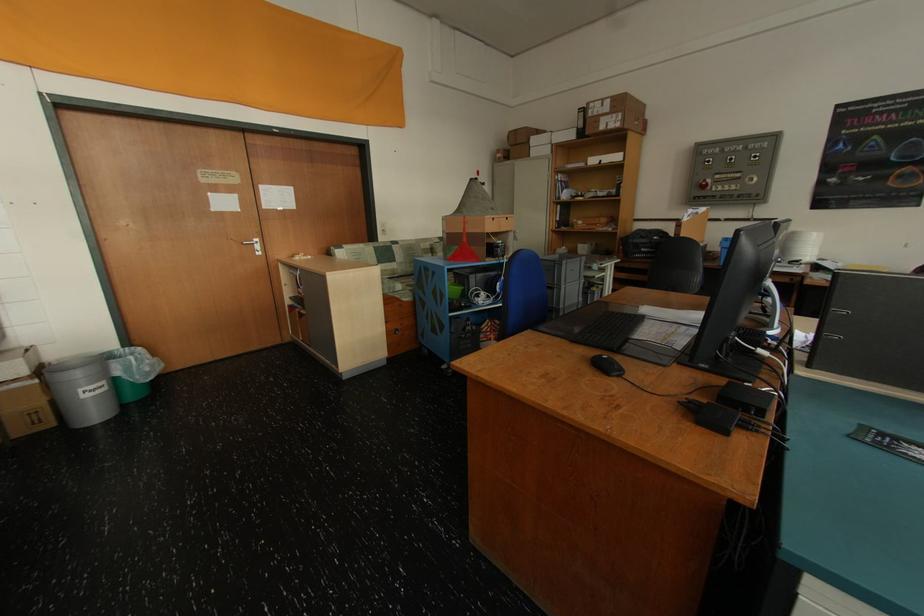
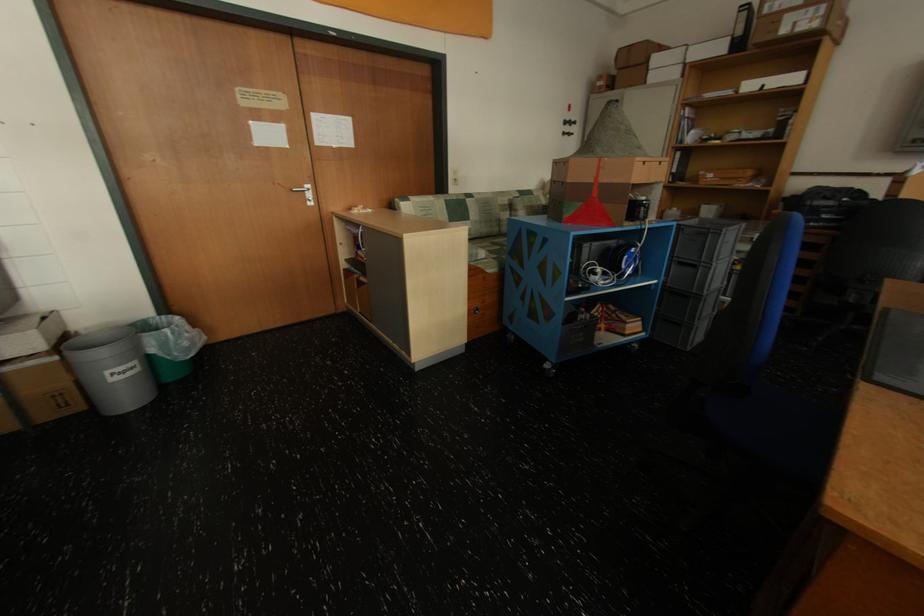
Find the pixel in the second image that matches point 112,384 in the first image.

(142, 363)